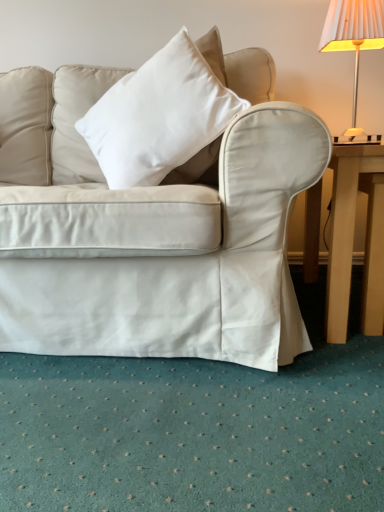
What do you see at coordinates (353, 239) in the screenshot?
I see `light brown wooden table at right` at bounding box center [353, 239].

The image size is (384, 512). What are the coordinates of `white cotton pillow at center` in the screenshot? It's located at (160, 118).

Is white cotton pillow at center oriented away from white pleated fabric lampshade at upper right?

white cotton pillow at center does not have its back to white pleated fabric lampshade at upper right.

From the image's perspective, would you say white cotton pillow at center is shown under white pleated fabric lampshade at upper right?

Yes, from the image's perspective, white cotton pillow at center is beneath white pleated fabric lampshade at upper right.

How different are the orientations of white cotton pillow at center and white pleated fabric lampshade at upper right in degrees?

The angular difference between white cotton pillow at center and white pleated fabric lampshade at upper right is 14.4 degrees.

Is white cotton pillow at center inside or outside of white pleated fabric lampshade at upper right?

white cotton pillow at center is not inside white pleated fabric lampshade at upper right, it's outside.

Which object is wider, white cotton pillow at center or light brown wooden table at right?

light brown wooden table at right.

From a real-world perspective, is white cotton pillow at center on light brown wooden table at right?

Indeed, from a real-world perspective, white cotton pillow at center stands above light brown wooden table at right.

In the scene shown: How many degrees apart are the facing directions of white cotton pillow at center and light brown wooden table at right?

The angular difference between white cotton pillow at center and light brown wooden table at right is 16.1 degrees.

Is white pleated fabric lampshade at upper right looking in the opposite direction of light brown wooden table at right?

No, white pleated fabric lampshade at upper right is not facing away from light brown wooden table at right.

Does white pleated fabric lampshade at upper right have a lesser height compared to light brown wooden table at right?

In fact, white pleated fabric lampshade at upper right may be taller than light brown wooden table at right.

Which is behind, point (337, 48) or point (342, 290)?

The point (337, 48) is behind.

Who is more distant, white pleated fabric lampshade at upper right or light brown wooden table at right?

white pleated fabric lampshade at upper right is behind.

Is light brown wooden table at right not within white pleated fabric lampshade at upper right?

light brown wooden table at right is positioned outside white pleated fabric lampshade at upper right.

From a real-world perspective, who is located lower, light brown wooden table at right or white pleated fabric lampshade at upper right?

light brown wooden table at right, from a real-world perspective.

In the image, is light brown wooden table at right on the left side or the right side of white pleated fabric lampshade at upper right?

From the image, it's evident that light brown wooden table at right is to the right of white pleated fabric lampshade at upper right.

Considering the points (355, 83) and (164, 90), which point is behind, point (355, 83) or point (164, 90)?

The point (355, 83) is more distant.

From the picture: Considering the relative sizes of white pleated fabric lampshade at upper right and white cotton pillow at center in the image provided, is white pleated fabric lampshade at upper right smaller than white cotton pillow at center?

Yes, white pleated fabric lampshade at upper right is smaller than white cotton pillow at center.

Looking at this image, considering the positions of objects white pleated fabric lampshade at upper right and white cotton pillow at center in the image provided, who is more to the right, white pleated fabric lampshade at upper right or white cotton pillow at center?

Positioned to the right is white pleated fabric lampshade at upper right.

The height and width of the screenshot is (512, 384). Identify the location of table that is below the white cotton pillow at center (from the image's perspective). (353, 239).

Could you tell me if light brown wooden table at right is turned towards white cotton pillow at center?

No, light brown wooden table at right is not oriented towards white cotton pillow at center.

Considering the points (335, 229) and (153, 100), which point is in front, point (335, 229) or point (153, 100)?

The point (335, 229) is closer to the camera.

In the scene shown: Considering the sizes of objects light brown wooden table at right and white cotton pillow at center in the image provided, who is smaller, light brown wooden table at right or white cotton pillow at center?

light brown wooden table at right is smaller.

Find the location of a particular element. The image size is (384, 512). lamp located behind the white cotton pillow at center is located at coordinates (353, 36).

Where is `pillow above the light brown wooden table at right (from the image's perspective)`? The width and height of the screenshot is (384, 512). pillow above the light brown wooden table at right (from the image's perspective) is located at coordinates (160, 118).

Looking at the image, which one is located closer to light brown wooden table at right, white cotton pillow at center or white pleated fabric lampshade at upper right?

white cotton pillow at center is closer to light brown wooden table at right.

From the image, which object appears to be farther from light brown wooden table at right, white pleated fabric lampshade at upper right or white cotton pillow at center?

Among the two, white pleated fabric lampshade at upper right is located further to light brown wooden table at right.

Considering their positions, is white pleated fabric lampshade at upper right positioned closer to white cotton pillow at center than light brown wooden table at right?

light brown wooden table at right lies closer to white cotton pillow at center than the other object.

From the image, which object appears to be nearer to white cotton pillow at center, light brown wooden table at right or white pleated fabric lampshade at upper right?

Based on the image, light brown wooden table at right appears to be nearer to white cotton pillow at center.

Which object lies further to the anchor point white pleated fabric lampshade at upper right, light brown wooden table at right or white cotton pillow at center?

white cotton pillow at center is further to white pleated fabric lampshade at upper right.

From the image, which object appears to be farther from white pleated fabric lampshade at upper right, white cotton pillow at center or light brown wooden table at right?

white cotton pillow at center lies further to white pleated fabric lampshade at upper right than the other object.

I want to click on lamp between white cotton pillow at center and light brown wooden table at right in the horizontal direction, so click(x=353, y=36).